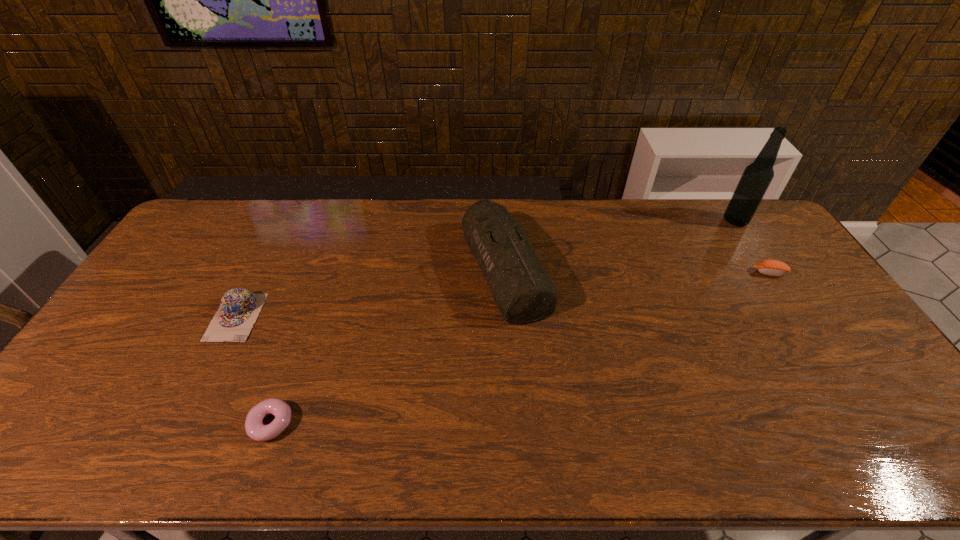
Where is `the tallest object`? The width and height of the screenshot is (960, 540). the tallest object is located at coordinates (756, 178).

The height and width of the screenshot is (540, 960). I want to click on the second tallest object, so (523, 291).

Locate an element on the screen. the third object from right to left is located at coordinates (523, 291).

Where is `the third tallest object`? Image resolution: width=960 pixels, height=540 pixels. the third tallest object is located at coordinates (239, 309).

Find the location of a particular element. The image size is (960, 540). the leftmost object is located at coordinates (239, 309).

The image size is (960, 540). What are the coordinates of `the fourth tallest object` in the screenshot? It's located at (770, 267).

The width and height of the screenshot is (960, 540). Identify the location of the nearest object. (255, 429).

Identify the location of the second object from left to right. (255, 429).

This screenshot has width=960, height=540. What are the coordinates of `free space located 0.390m on the left of the tallest object` in the screenshot? It's located at (616, 221).

Where is `blank space located on the left of the fourth shortest object`? blank space located on the left of the fourth shortest object is located at coordinates (363, 269).